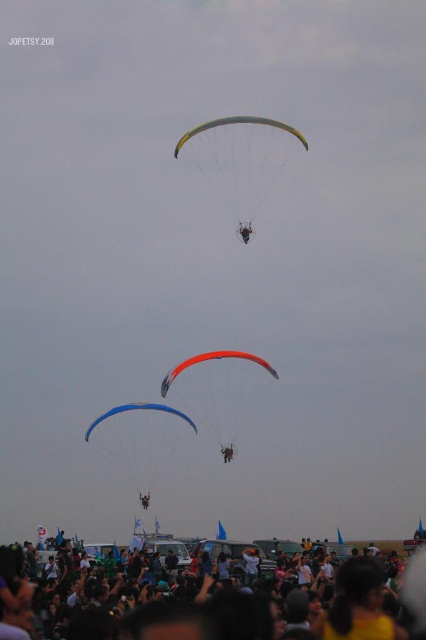
From the picture: Which of these two, orange matte parachute at center or blue matte parachute at center, stands taller?

With more height is blue matte parachute at center.

This screenshot has height=640, width=426. What do you see at coordinates (210, 360) in the screenshot? I see `orange matte parachute at center` at bounding box center [210, 360].

This screenshot has height=640, width=426. What are the coordinates of `orange matte parachute at center` in the screenshot? It's located at (210, 360).

Does matte black crowd at lower center appear on the right side of blue matte parachute at center?

Yes, matte black crowd at lower center is to the right of blue matte parachute at center.

Between matte black crowd at lower center and blue matte parachute at center, which one has less height?

Standing shorter between the two is matte black crowd at lower center.

Does point (20, 564) come in front of point (170, 412)?

No, (20, 564) is behind (170, 412).

Locate an element on the screen. The width and height of the screenshot is (426, 640). matte black crowd at lower center is located at coordinates (178, 618).

Can you confirm if yellow-green fabric parachute at upper center is smaller than orange matte parachute at center?

Incorrect, yellow-green fabric parachute at upper center is not smaller in size than orange matte parachute at center.

Image resolution: width=426 pixels, height=640 pixels. Describe the element at coordinates (241, 161) in the screenshot. I see `yellow-green fabric parachute at upper center` at that location.

Which is in front, point (249, 125) or point (187, 362)?

Point (187, 362) is more forward.

The height and width of the screenshot is (640, 426). I want to click on yellow-green fabric parachute at upper center, so click(x=241, y=161).